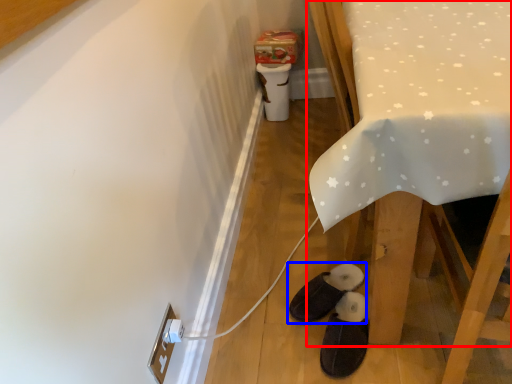
Question: Which object is further to the camera taking this photo, furniture (highlighted by a red box) or footwear (highlighted by a blue box)?

Choices:
 (A) furniture
 (B) footwear

Answer: (B)